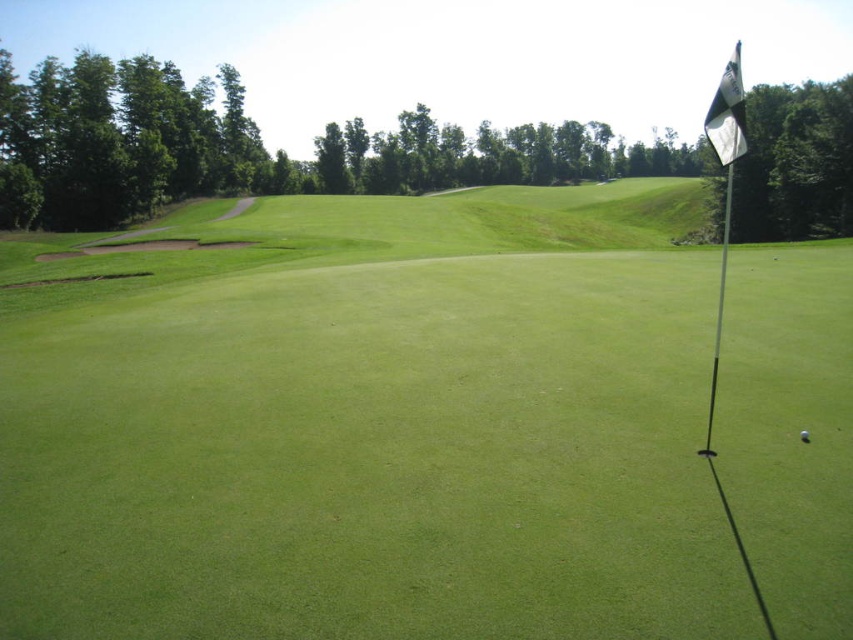
Question: Can you confirm if white fabric flag at upper right is thinner than white plastic golf club at right?

Choices:
 (A) yes
 (B) no

Answer: (B)

Question: Can you confirm if white fabric flag at upper right is positioned to the left of white plastic golf club at right?

Choices:
 (A) yes
 (B) no

Answer: (B)

Question: Can you confirm if green grassy golf course at center is positioned to the left of white fabric flag at upper right?

Choices:
 (A) no
 (B) yes

Answer: (B)

Question: Among these points, which one is nearest to the camera?

Choices:
 (A) (727, 209)
 (B) (723, 120)

Answer: (B)

Question: Which point is farther to the camera?

Choices:
 (A) white plastic golf club at right
 (B) green grassy golf course at center
 (C) white matte golf ball at center
 (D) white fabric flag at upper right

Answer: (C)

Question: Which object is the closest to the green grassy golf course at center?

Choices:
 (A) white fabric flag at upper right
 (B) white plastic golf club at right
 (C) white matte golf ball at center

Answer: (B)